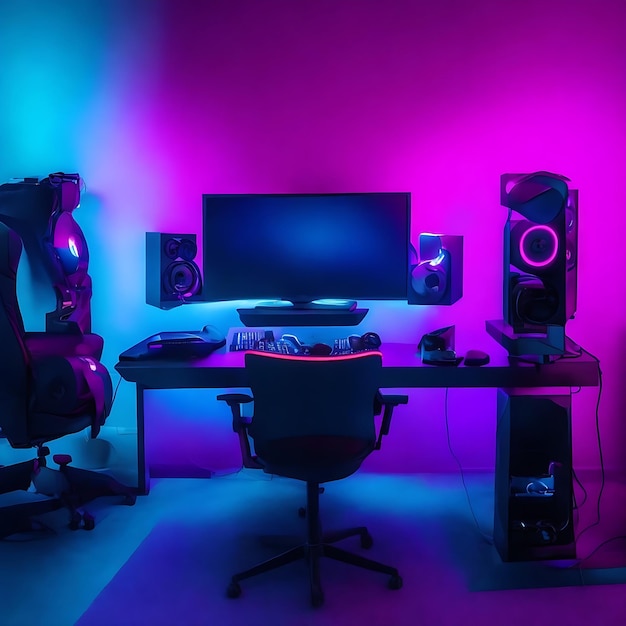
Where is `wall`? The image size is (626, 626). wall is located at coordinates (120, 167).